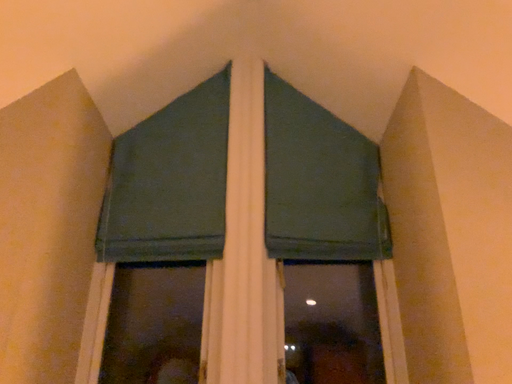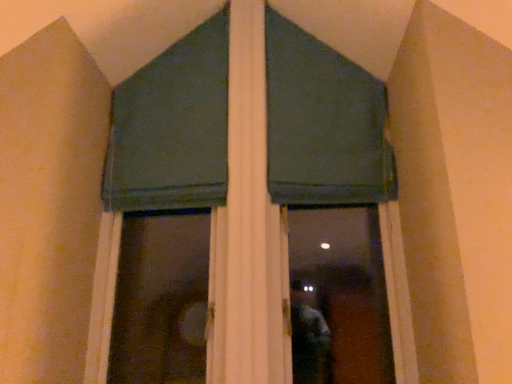
Question: How did the camera likely rotate when shooting the video?

Choices:
 (A) rotated upward
 (B) rotated downward

Answer: (B)